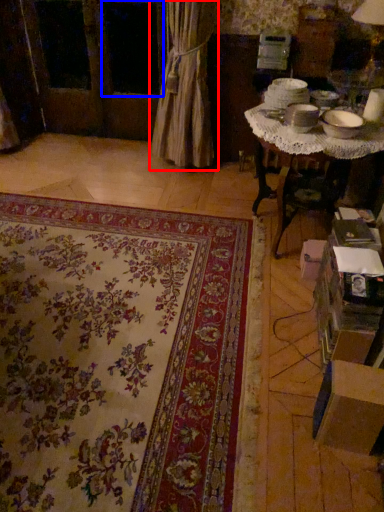
Question: Which point is further to the camera, curtain (highlighted by a red box) or window (highlighted by a blue box)?

Choices:
 (A) curtain
 (B) window

Answer: (B)